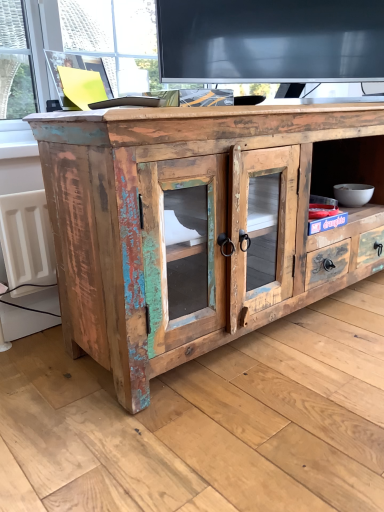
You are a GUI agent. You are given a task and a screenshot of the screen. Output one action in this format:
    pyautogui.click(x=<x>, y=<y>)
    Task: Click on the distressed wood cabinet at center
    
    Given the screenshot: What is the action you would take?
    pyautogui.click(x=207, y=222)

Describe the element at coordinates (207, 222) in the screenshot. I see `distressed wood cabinet at center` at that location.

This screenshot has width=384, height=512. What do you see at coordinates (27, 239) in the screenshot?
I see `white plastic radiator at left` at bounding box center [27, 239].

You are a GUI agent. You are given a task and a screenshot of the screen. Output one action in this format:
    pyautogui.click(x=<x>, y=<y>)
    Task: Click on the white plastic radiator at left
    Image resolution: width=384 pixels, height=512 pixels.
    Given the screenshot: What is the action you would take?
    pyautogui.click(x=27, y=239)

Locate an element on the screen. This screenshot has height=512, width=384. distressed wood cabinet at center is located at coordinates (207, 222).

Considering the relative positions of white plastic radiator at left and distressed wood cabinet at center in the image provided, is white plastic radiator at left to the left of distressed wood cabinet at center from the viewer's perspective?

Correct, you'll find white plastic radiator at left to the left of distressed wood cabinet at center.

Does white plastic radiator at left lie behind distressed wood cabinet at center?

Yes, the depth of white plastic radiator at left is greater than that of distressed wood cabinet at center.

Considering the points (19, 275) and (152, 185), which point is behind, point (19, 275) or point (152, 185)?

Positioned behind is point (19, 275).

Consider the image. From the image's perspective, does white plastic radiator at left appear lower than distressed wood cabinet at center?

Indeed, from the image's perspective, white plastic radiator at left is shown beneath distressed wood cabinet at center.

From a real-world perspective, which object stands above the other?

distressed wood cabinet at center is physically above.

Does white plastic radiator at left have a greater width compared to distressed wood cabinet at center?

Incorrect, the width of white plastic radiator at left does not surpass that of distressed wood cabinet at center.

From their relative heights in the image, would you say white plastic radiator at left is taller or shorter than distressed wood cabinet at center?

Clearly, white plastic radiator at left is shorter compared to distressed wood cabinet at center.

Is white plastic radiator at left bigger or smaller than distressed wood cabinet at center?

In the image, white plastic radiator at left appears to be smaller than distressed wood cabinet at center.

Is white plastic radiator at left inside or outside of distressed wood cabinet at center?

white plastic radiator at left is spatially situated outside distressed wood cabinet at center.

Is white plastic radiator at left not near distressed wood cabinet at center?

No, white plastic radiator at left is in close proximity to distressed wood cabinet at center.

Is distressed wood cabinet at center at the back of white plastic radiator at left?

white plastic radiator at left is not turned away from distressed wood cabinet at center.

Can you tell me how much white plastic radiator at left and distressed wood cabinet at center differ in facing direction?

white plastic radiator at left and distressed wood cabinet at center are facing 0.909 degrees away from each other.

Where is `radiator lying below the distressed wood cabinet at center (from the image's perspective)`? This screenshot has width=384, height=512. radiator lying below the distressed wood cabinet at center (from the image's perspective) is located at coordinates (27, 239).

Which is more to the left, distressed wood cabinet at center or white plastic radiator at left?

white plastic radiator at left.

Is distressed wood cabinet at center closer to camera compared to white plastic radiator at left?

Yes, distressed wood cabinet at center is closer to the viewer.

Is point (375, 229) farther from viewer compared to point (46, 254)?

Yes, point (375, 229) is farther from viewer.

From the image's perspective, which object appears higher, distressed wood cabinet at center or white plastic radiator at left?

distressed wood cabinet at center, from the image's perspective.

From a real-world perspective, which is physically above, distressed wood cabinet at center or white plastic radiator at left?

distressed wood cabinet at center, from a real-world perspective.

Considering the sizes of distressed wood cabinet at center and white plastic radiator at left in the image, is distressed wood cabinet at center wider or thinner than white plastic radiator at left?

→ distressed wood cabinet at center is wider than white plastic radiator at left.

In terms of height, does distressed wood cabinet at center look taller or shorter compared to white plastic radiator at left?

distressed wood cabinet at center is taller than white plastic radiator at left.

Which of these two, distressed wood cabinet at center or white plastic radiator at left, is bigger?

distressed wood cabinet at center is bigger.

Based on the photo, is distressed wood cabinet at center positioned beyond the bounds of white plastic radiator at left?

Yes, distressed wood cabinet at center is located beyond the bounds of white plastic radiator at left.

Are distressed wood cabinet at center and white plastic radiator at left located far from each other?

Actually, distressed wood cabinet at center and white plastic radiator at left are a little close together.

Is distressed wood cabinet at center oriented away from white plastic radiator at left?

Correct, distressed wood cabinet at center is looking away from white plastic radiator at left.

Find the location of a particular element. This screenshot has width=384, height=512. the chest of drawers that appears in front of the white plastic radiator at left is located at coordinates (207, 222).

Where is `chest of drawers above the white plastic radiator at left (from a real-world perspective)`? This screenshot has width=384, height=512. chest of drawers above the white plastic radiator at left (from a real-world perspective) is located at coordinates (207, 222).

Where is `chest of drawers in front of the white plastic radiator at left`? chest of drawers in front of the white plastic radiator at left is located at coordinates (207, 222).